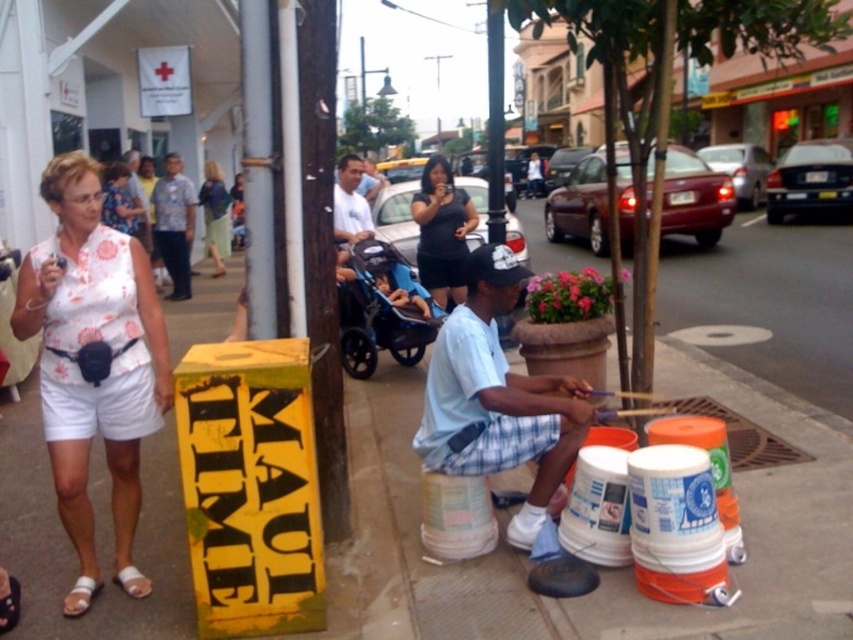
Question: Is smooth concrete pavement at center thinner than light blue shirt at center?

Choices:
 (A) yes
 (B) no

Answer: (B)

Question: Which point is closer to the camera?

Choices:
 (A) (120, 196)
 (B) (363, 198)

Answer: (B)

Question: Which object is the closest to the matte black dress at center?

Choices:
 (A) matte blue shirt at center
 (B) light blue fabric at center

Answer: (A)

Question: Can you confirm if printed fabric shirt at center is bigger than light blue denim shorts at lower center?

Choices:
 (A) no
 (B) yes

Answer: (A)

Question: Which point is closer to the camera?

Choices:
 (A) smooth concrete pavement at center
 (B) printed fabric shirt at center

Answer: (A)

Question: Is smooth concrete pavement at center smaller than light blue fabric at center?

Choices:
 (A) no
 (B) yes

Answer: (A)